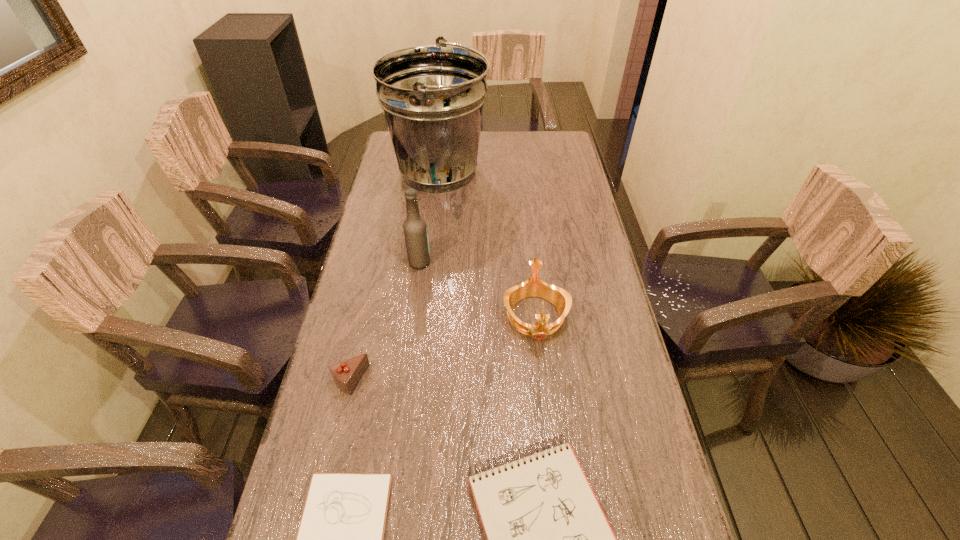
Image resolution: width=960 pixels, height=540 pixels. Find the location of `vacant space located at the front emblem of the third farthest object`. vacant space located at the front emblem of the third farthest object is located at coordinates (551, 452).

Where is `free space located on the front of the fourth tallest object`? The image size is (960, 540). free space located on the front of the fourth tallest object is located at coordinates (318, 518).

The image size is (960, 540). I want to click on object positioned at the far edge, so click(x=432, y=97).

This screenshot has width=960, height=540. I want to click on bucket at the left edge, so click(432, 97).

You are a GUI agent. You are given a task and a screenshot of the screen. Output one action in this format:
    pyautogui.click(x=<x>, y=<y>)
    Task: Click on the chocolate cake at the left edge
    
    Given the screenshot: What is the action you would take?
    pyautogui.click(x=346, y=374)

Locate an element on the screen. object present at the right edge is located at coordinates (533, 287).

This screenshot has width=960, height=540. What are the coordinates of `object located at the far left corner` in the screenshot? It's located at (432, 97).

You are a GUI agent. You are given a task and a screenshot of the screen. Output one action in this format:
    pyautogui.click(x=<x>, y=<y>)
    Task: Click on the vacant space at the far edge of the desktop
    This screenshot has height=540, width=960.
    Given the screenshot: What is the action you would take?
    pyautogui.click(x=491, y=150)

In the image, there is a desktop. Where is `free space at the left edge`? Image resolution: width=960 pixels, height=540 pixels. free space at the left edge is located at coordinates (372, 290).

The width and height of the screenshot is (960, 540). I want to click on free point at the right edge, so click(x=577, y=250).